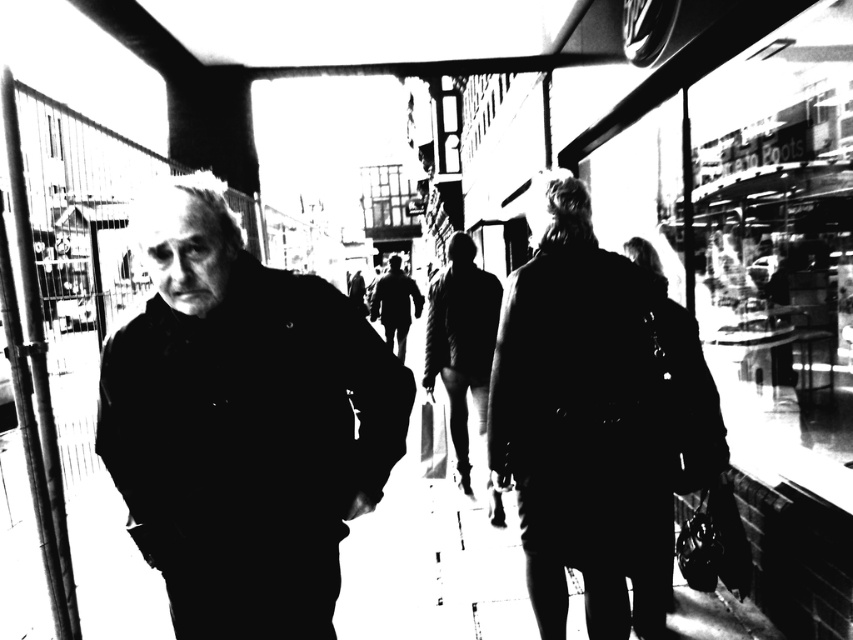
Does point (334, 524) come closer to viewer compared to point (593, 428)?

Yes, it is.

Based on the photo, can you confirm if dark matte jacket at center is bigger than silky black coat at center?

No, dark matte jacket at center is not bigger than silky black coat at center.

Between point (268, 579) and point (631, 532), which one is positioned behind?

Positioned behind is point (631, 532).

Identify the location of dark matte jacket at center. Image resolution: width=853 pixels, height=640 pixels. (242, 422).

Which is more to the left, dark matte jacket at center or smooth leather jacket at center?

From the viewer's perspective, dark matte jacket at center appears more on the left side.

Does point (283, 529) come behind point (432, 326)?

No, it is not.

The height and width of the screenshot is (640, 853). What do you see at coordinates (242, 422) in the screenshot? I see `dark matte jacket at center` at bounding box center [242, 422].

Where is `dark matte jacket at center`? dark matte jacket at center is located at coordinates point(242,422).

Is silky black coat at center shorter than smooth leather jacket at center?

No.

Is silky black coat at center positioned in front of smooth leather jacket at center?

Yes, silky black coat at center is closer to the viewer.

Is point (614, 563) farther from viewer compared to point (473, 250)?

No, (614, 563) is closer to viewer.

At what (x,y) coordinates should I click in order to perform the action: click on silky black coat at center. Please return your answer as a coordinate pair (x, y). Image resolution: width=853 pixels, height=640 pixels. Looking at the image, I should click on (595, 417).